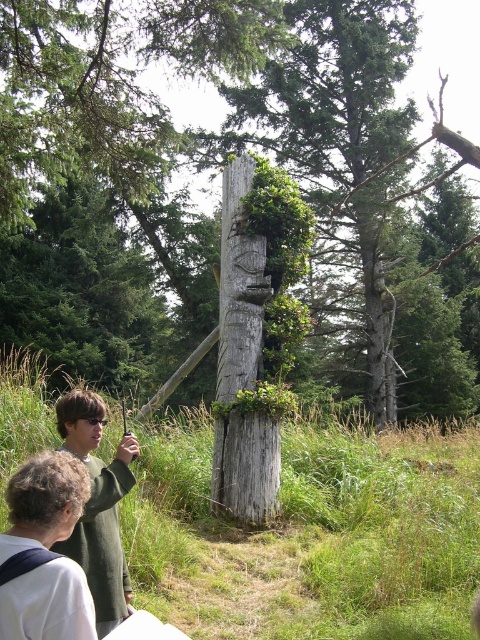
You are standing in the outdoor scene with the wooden totem pole surrounded by tall grasses and dense evergreen trees. You notice two people at lower left wearing green clothing. Which clothing item, the green fabric shirt at lower left or the green wool sweater at lower left, is positioned higher on the person?

The green fabric shirt at lower left is above the green wool sweater at lower left, so the green fabric shirt at lower left is positioned higher on the person.

You are standing at the center of the scene and want to take a photo of the weathered wood totem pole at center. Which direction should you face to ensure the totem pole is in the frame?

Since the weathered wood totem pole at center is already located at the center of the scene, you should face directly forward to have it in the frame.

You are standing in front of the wooden totem pole and notice two points marked in the scene. One is at coordinates point (106,189) and the other is at point (96,429). Which point is closer to you?

Point (96,429) is closer to you because it is less further to the camera than point (106,189).